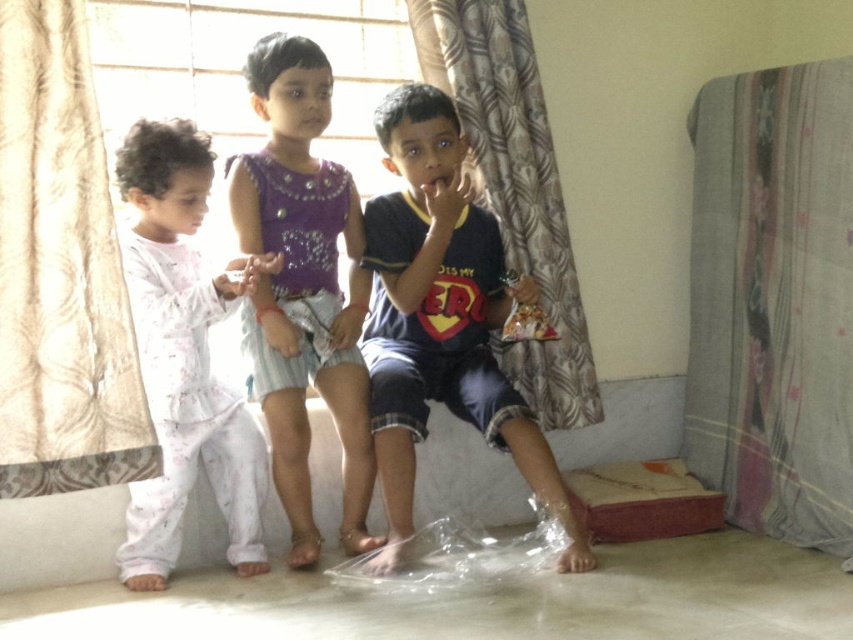
Question: Among these points, which one is nearest to the camera?

Choices:
 (A) (189, 332)
 (B) (242, 220)
 (C) (583, 412)
 (D) (7, 278)

Answer: (D)

Question: Which object is the closest to the floral fabric curtain at right?

Choices:
 (A) transparent plastic bag at lower center
 (B) beige floral curtain at left
 (C) patterned fabric curtain at center
 (D) light pink cotton pajamas at left

Answer: (C)

Question: Is purple sequined dress at center bigger than transparent plastic bag at lower center?

Choices:
 (A) yes
 (B) no

Answer: (A)

Question: Estimate the real-world distances between objects in this image. Which object is closer to the light pink cotton pajamas at left?

Choices:
 (A) floral fabric curtain at right
 (B) transparent plastic bag at lower center

Answer: (B)

Question: Can you confirm if beige floral curtain at left is positioned to the left of purple sequined dress at center?

Choices:
 (A) no
 (B) yes

Answer: (B)

Question: Can you confirm if purple sequined dress at center is positioned above patterned fabric curtain at center?

Choices:
 (A) no
 (B) yes

Answer: (A)